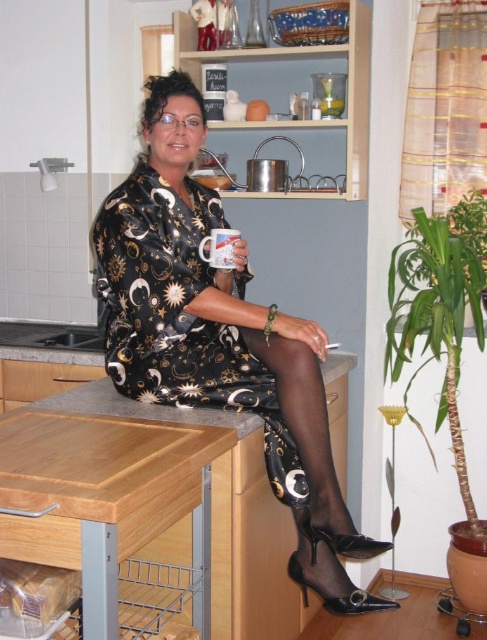
You are a chef preparing to place a new decorative item on the kitchen counter. You have a metallic dress at center and a white ceramic mug at center in front of you. Which object should you choose if you want to place an item that is taller than the other?

The metallic dress at center is taller than the white ceramic mug at center, so you should choose the metallic dress at center if you want to place an item that is taller than the other.

You are a delivery person who needs to place a metallic dress at center and a white ceramic mug at center on a shelf that can only hold items up to 30 cm in height. Given their sizes, can both items fit on the shelf?

The metallic dress at center has a larger size compared to white ceramic mug at center. If the metallic dress at center is under 30 cm in height, both items can fit. However, if the metallic dress at center exceeds 30 cm, it cannot be placed on the shelf.

Based on the scene description, where is the metallic dress at center located in terms of coordinates?

The metallic dress at center is located at point (x=220, y=337).